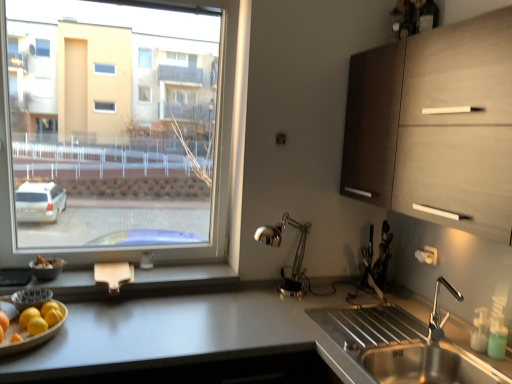
What are the coordinates of `free point to the right of matte black bowl at lower left` in the screenshot? It's located at (78, 284).